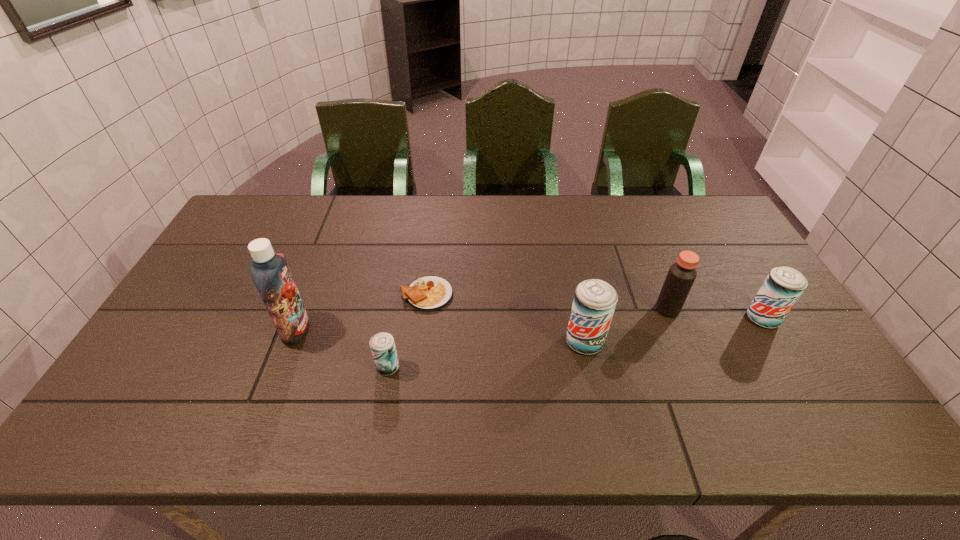
With all beer cans evenly spaced, where should an extra beer can be placed on the left to continue the pattern? Please point out a vacant space. Please provide its 2D coordinates. Your answer should be formatted as a tuple, i.e. [(x, y)], where the tuple contains the x and y coordinates of a point satisfying the conditions above.

[(170, 395)]